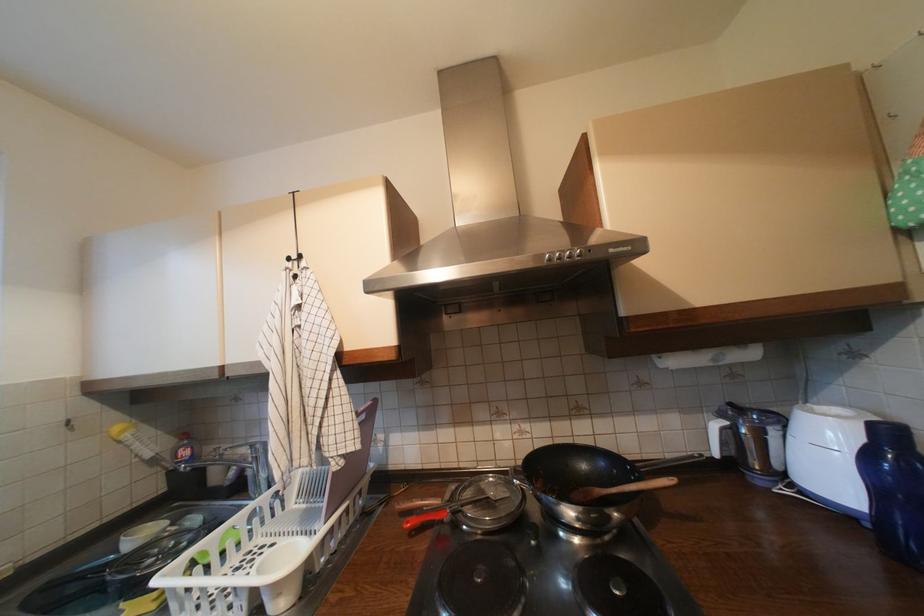
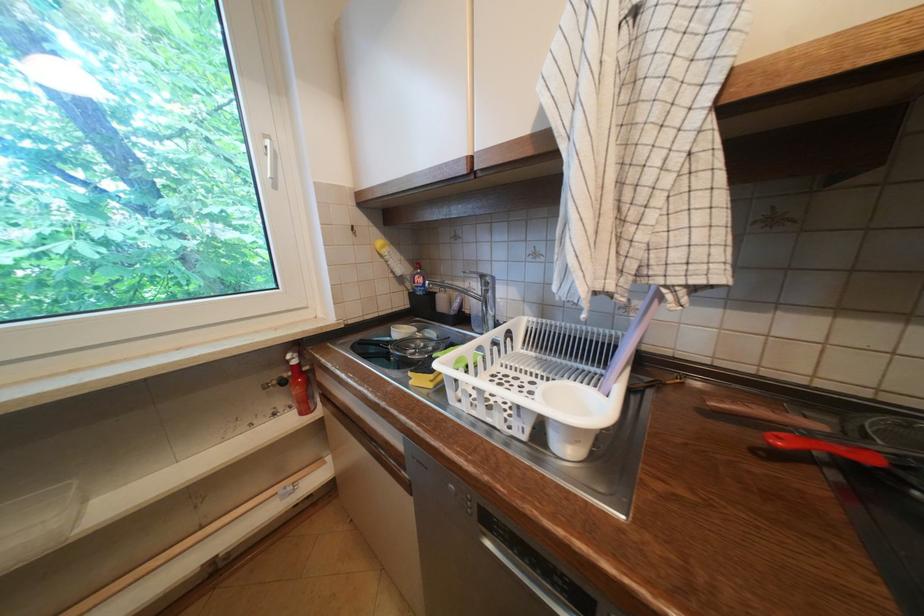
Locate, in the second image, the point that corresponds to the point at 168,471 in the first image.

(412, 291)